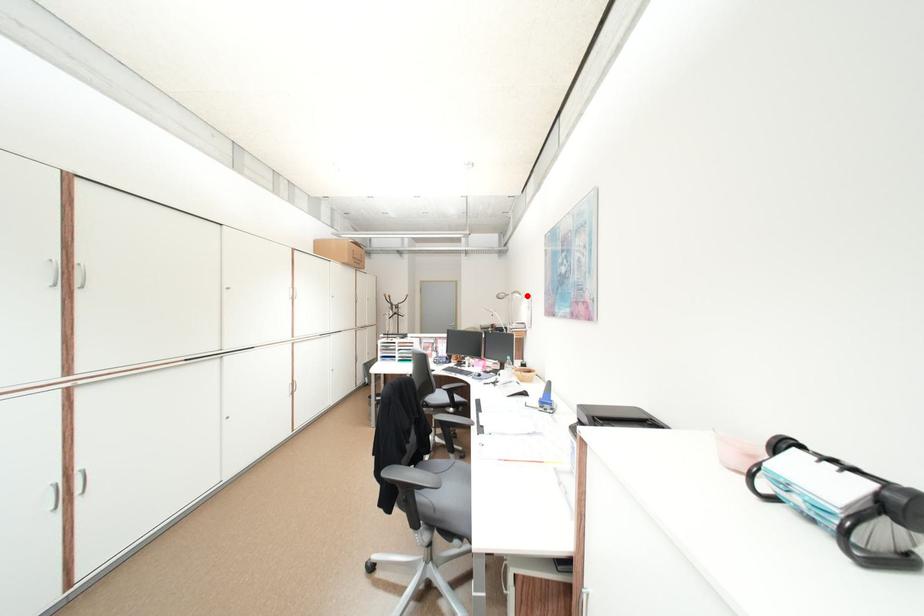
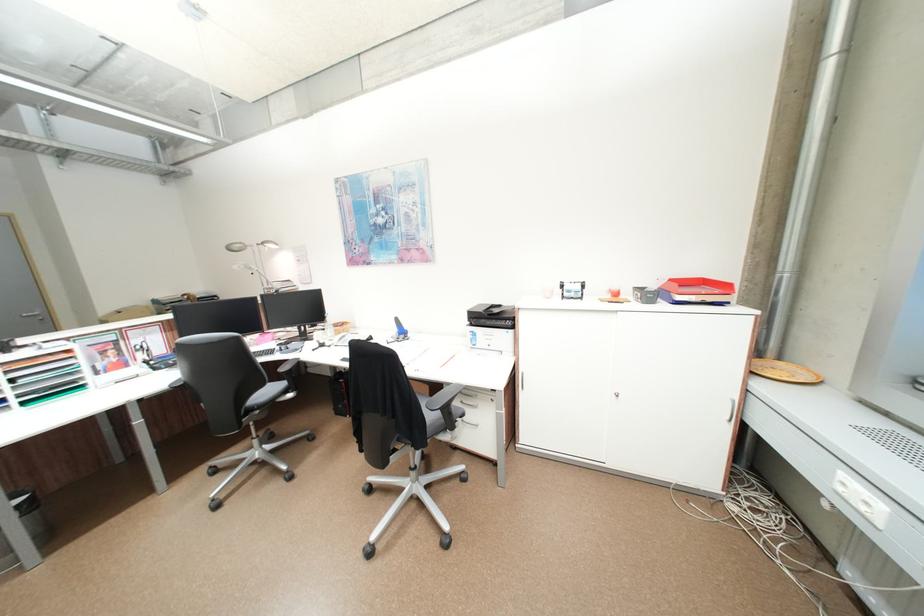
Question: I am providing you with two images of the same scene from different viewpoints. Given a red point in image1, look at the same physical point in image2. Is it:

Choices:
 (A) Closer to the viewpoint
 (B) Farther from the viewpoint

Answer: (A)